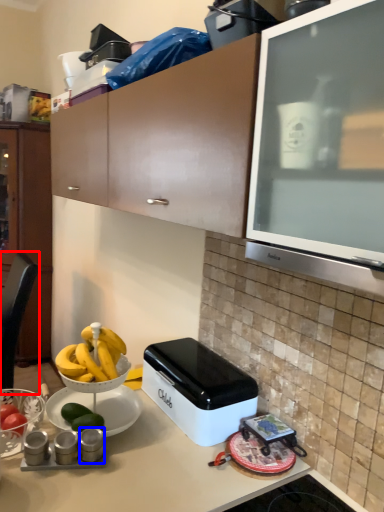
Question: Which of the following is the closest to the observer, chair (highlighted by a red box) or appliance (highlighted by a blue box)?

Choices:
 (A) chair
 (B) appliance

Answer: (B)